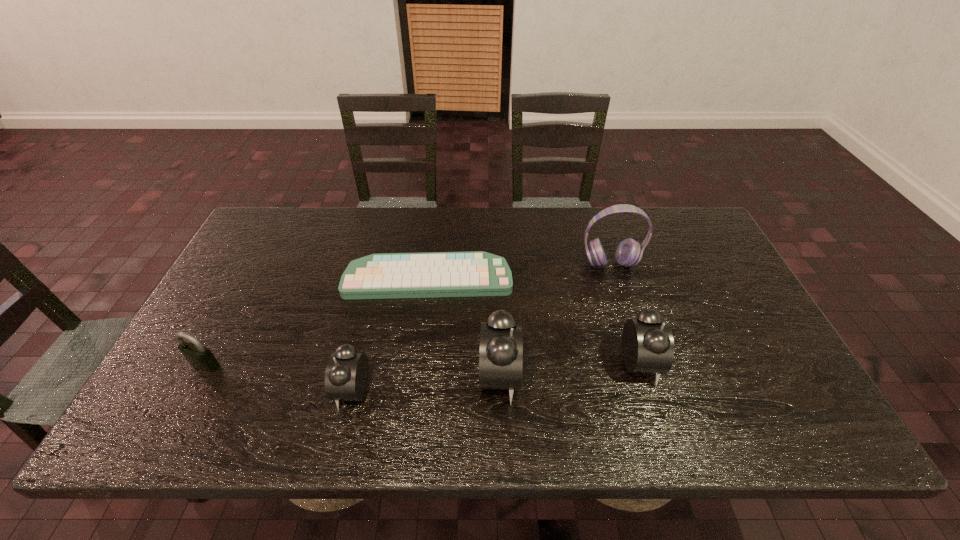
Please show where to add a alarm clock on the right while keeping spacing even. Please provide its 2D coordinates. Your answer should be formatted as a tuple, i.e. [(x, y)], where the tuple contains the x and y coordinates of a point satisfying the conditions above.

[(774, 352)]